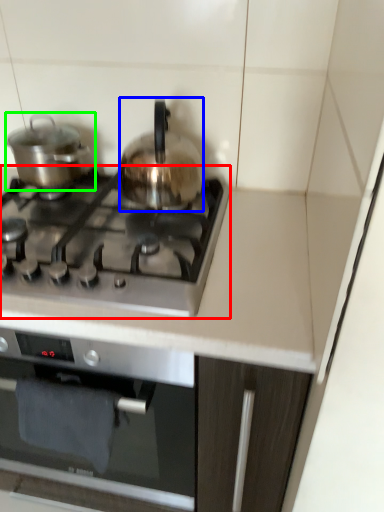
Question: Which is farther away from gas stove (highlighted by a red box)? kitchen appliance (highlighted by a blue box) or kitchen appliance (highlighted by a green box)?

Choices:
 (A) kitchen appliance
 (B) kitchen appliance

Answer: (B)